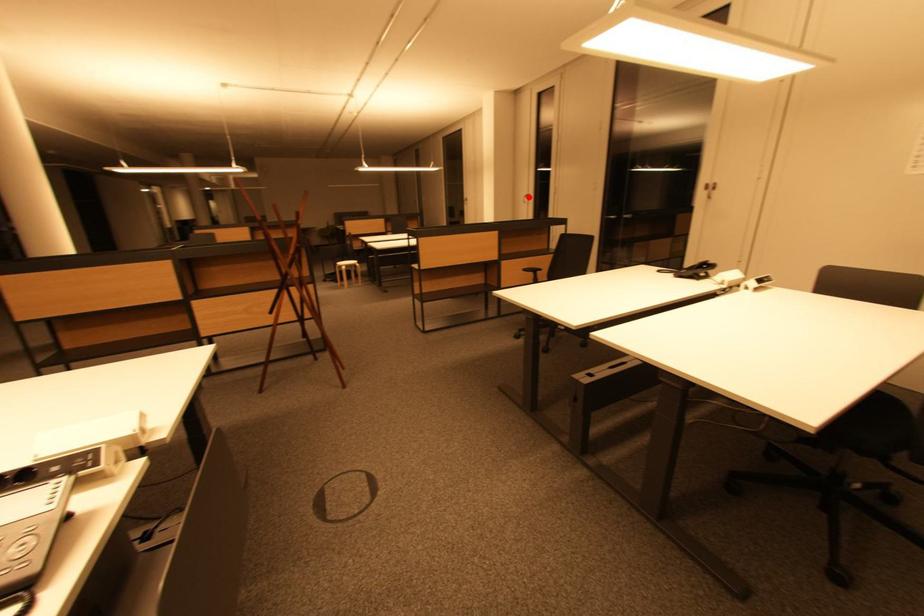
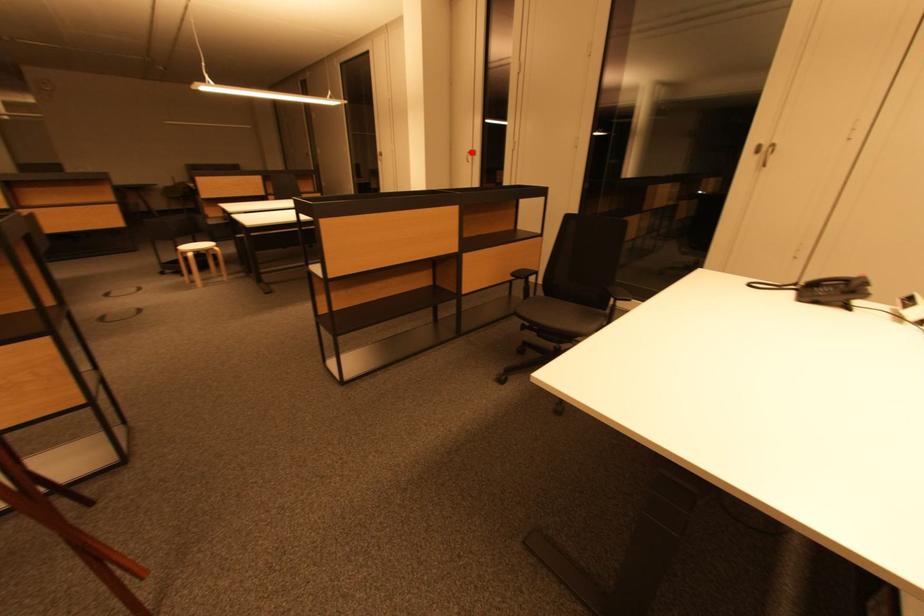
I am providing you with two images of the same scene from different viewpoints. A red point is marked on the first image and another point is marked on the second image. Does the point marked in image1 correspond to the same location as the one in image2?

Yes